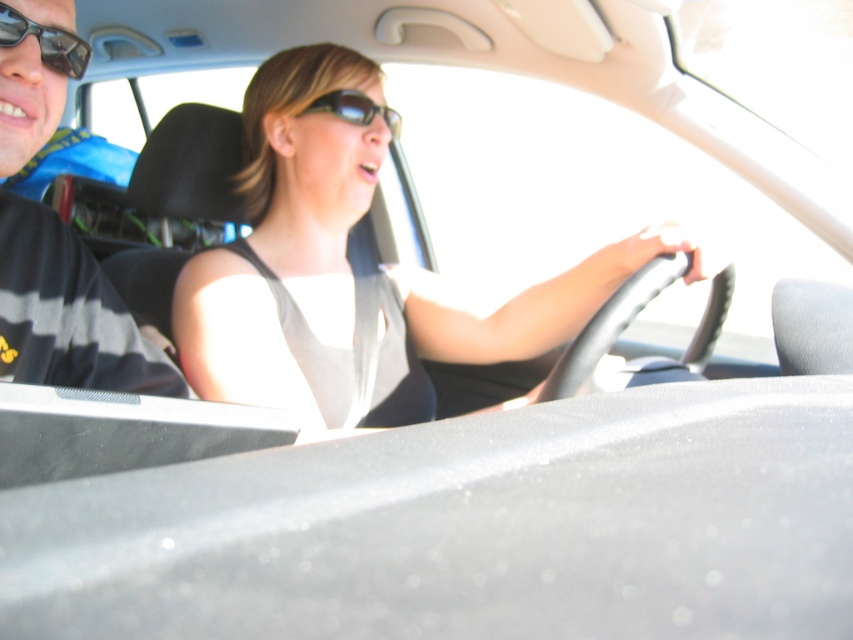
You are a fashion designer observing the car interior scene. You need to determine which item is larger between the black striped shirt at left and the sunglasses at center. Which one is bigger?

The black striped shirt at left is bigger than the sunglasses at center.

You are a fashion designer observing the car interior scene. You need to determine which clothing item, the white fabric tank top at center or the black striped shirt at left, would require more fabric to produce based on their sizes in the image. Which one would need more fabric?

The white fabric tank top at center has a larger size compared to the black striped shirt at left, so it would require more fabric to produce.